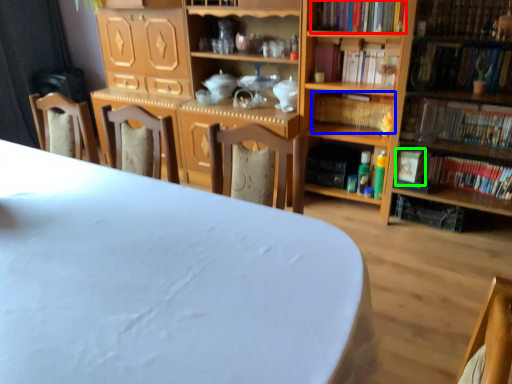
Question: Which object is positioned closest to book (highlighted by a red box)? Select from book (highlighted by a blue box) and paperback book (highlighted by a green box).

Choices:
 (A) book
 (B) paperback book

Answer: (A)